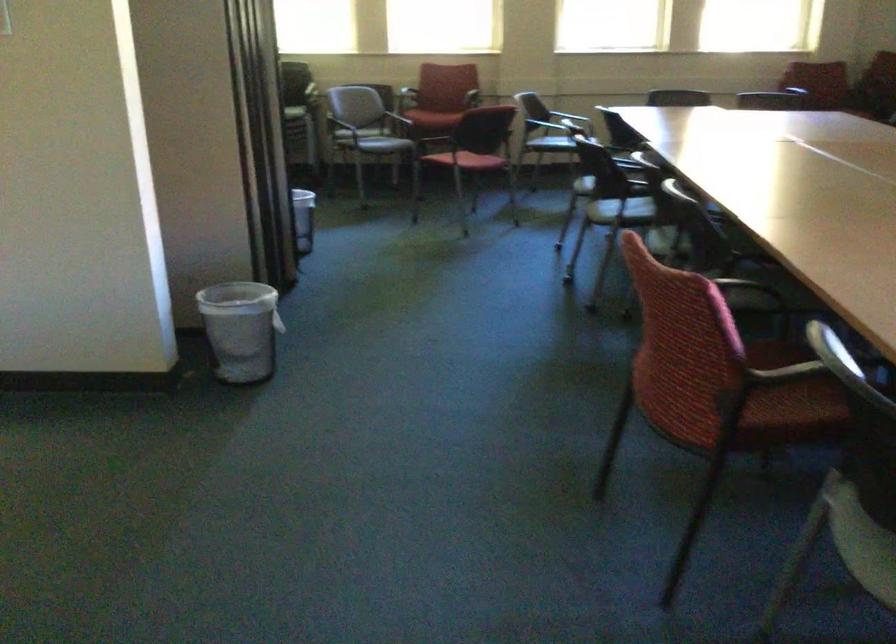
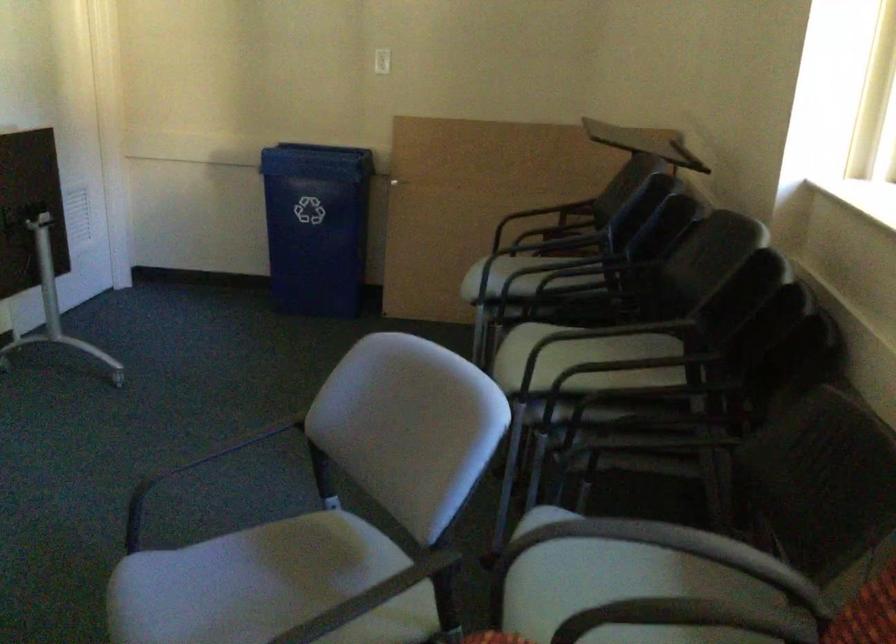
Where in the second image is the point corresponding to pixel 382 129 from the first image?

(586, 564)